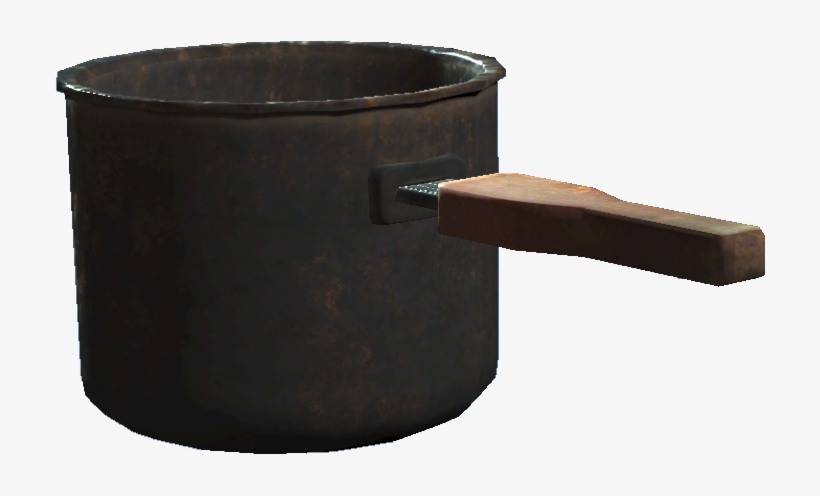
The width and height of the screenshot is (820, 496). Identify the location of handle to the right of pot. (574, 215).